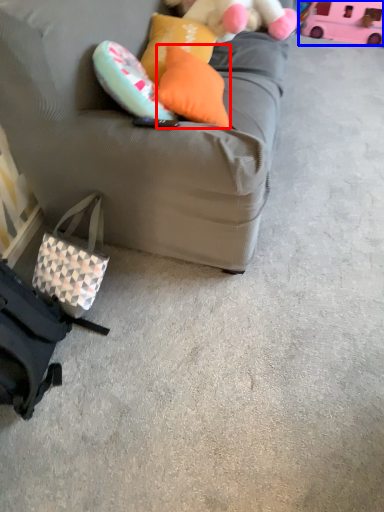
Question: Which object is further to the camera taking this photo, pillow (highlighted by a red box) or toy (highlighted by a blue box)?

Choices:
 (A) pillow
 (B) toy

Answer: (B)